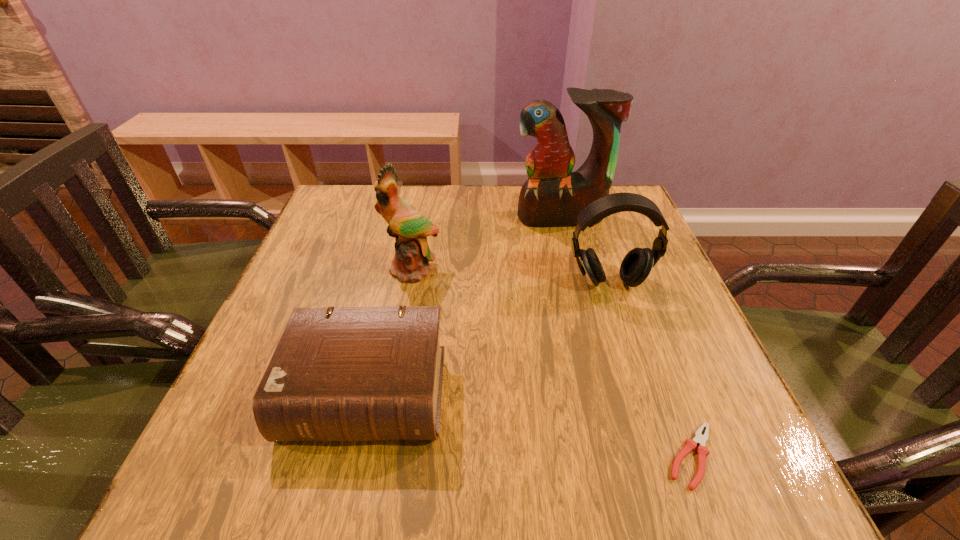
Locate an element on the screen. free point between the right parrot and the shorter parrot is located at coordinates (487, 244).

The height and width of the screenshot is (540, 960). I want to click on empty location between the shortest object and the farthest object, so click(626, 337).

Identify the location of free space between the fourth tallest object and the pliers. This screenshot has height=540, width=960. (529, 424).

The width and height of the screenshot is (960, 540). Find the location of `vacant area that lies between the nearer parrot and the earphone`. vacant area that lies between the nearer parrot and the earphone is located at coordinates (510, 276).

The image size is (960, 540). I want to click on free spot between the second tallest object and the shortest object, so click(x=552, y=363).

Identify the location of free space between the farthest object and the shorter parrot. The image size is (960, 540). (487, 244).

Where is `free spot between the nearer parrot and the third shortest object`? free spot between the nearer parrot and the third shortest object is located at coordinates (510, 276).

I want to click on object that can be found as the third closest to the third shortest object, so click(350, 373).

Locate which object ranks in proximity to the Bible. Please provide its 2D coordinates. Your answer should be formatted as a tuple, i.e. [(x, y)], where the tuple contains the x and y coordinates of a point satisfying the conditions above.

[(410, 228)]

Where is `blank space that satisfies the following two spatial constraints: 1. on the ear cups of the third tallest object; 2. on the right side of the shortest object`? The width and height of the screenshot is (960, 540). blank space that satisfies the following two spatial constraints: 1. on the ear cups of the third tallest object; 2. on the right side of the shortest object is located at coordinates (665, 456).